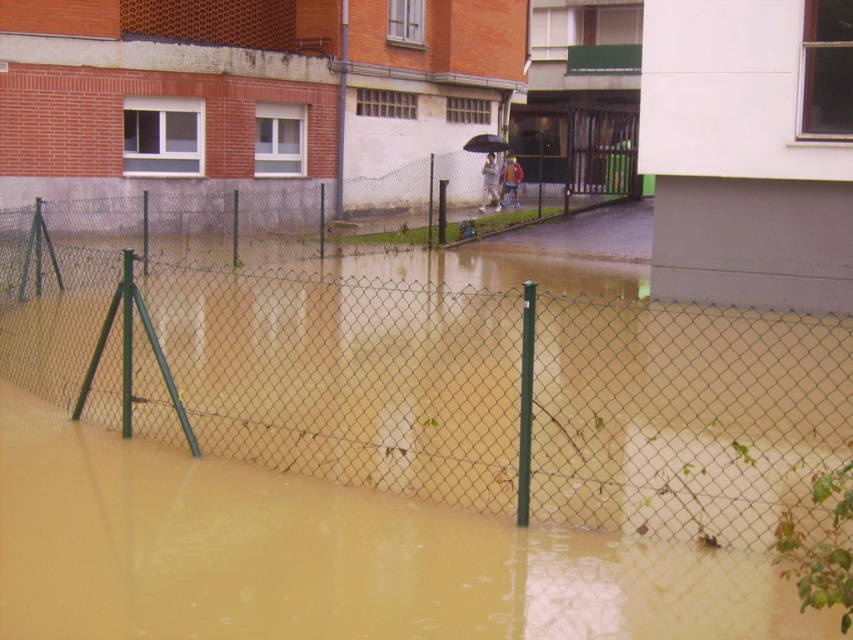
Does point (379, 634) come farther from viewer compared to point (485, 147)?

No, (379, 634) is in front of (485, 147).

Is brown muddy water at lower center to the left of black matte umbrella at center from the viewer's perspective?

Indeed, brown muddy water at lower center is positioned on the left side of black matte umbrella at center.

Locate an element on the screen. brown muddy water at lower center is located at coordinates (326, 556).

Between brown muddy water at lower center and green chain-link fence at center, which one is positioned higher?

green chain-link fence at center is above.

Is brown muddy water at lower center behind green chain-link fence at center?

No, it is in front of green chain-link fence at center.

Between point (766, 572) and point (357, 220), which one is positioned in front?

Point (766, 572) is in front.

At what (x,y) coordinates should I click in order to perform the action: click on brown muddy water at lower center. Please return your answer as a coordinate pair (x, y). Image resolution: width=853 pixels, height=640 pixels. Looking at the image, I should click on (326, 556).

Is point (93, 276) in front of point (463, 145)?

Yes.

Can you confirm if green chain-link fence at center is positioned to the left of black matte umbrella at center?

Indeed, green chain-link fence at center is positioned on the left side of black matte umbrella at center.

Does point (370, 237) lie in front of point (489, 138)?

Yes.

Locate an element on the screen. green chain-link fence at center is located at coordinates (270, 221).